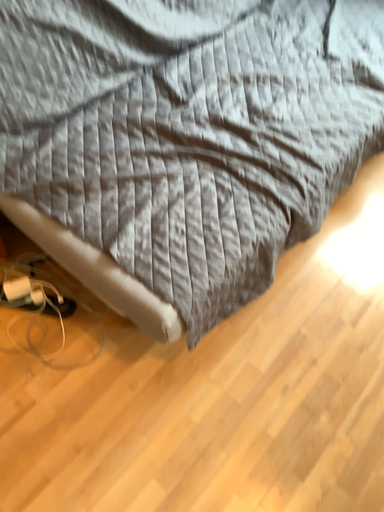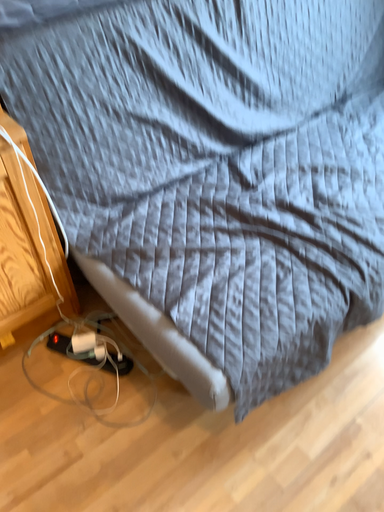
Question: How did the camera likely rotate when shooting the video?

Choices:
 (A) rotated upward
 (B) rotated downward

Answer: (A)